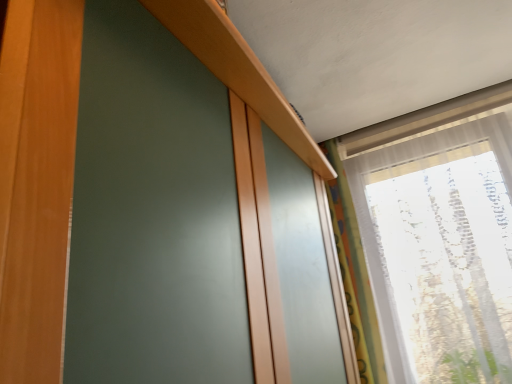
This screenshot has width=512, height=384. What do you see at coordinates (354, 273) in the screenshot?
I see `multicolored fabric curtain at right` at bounding box center [354, 273].

Identify the location of multicolored fabric curtain at right. The image size is (512, 384). coord(354,273).

The height and width of the screenshot is (384, 512). What do you see at coordinates (439, 237) in the screenshot? I see `transparent fabric at upper right` at bounding box center [439, 237].

You are a GUI agent. You are given a task and a screenshot of the screen. Output one action in this format:
    pyautogui.click(x=<x>, y=<y>)
    Task: Click on the transparent fabric at upper right
    
    Given the screenshot: What is the action you would take?
    pyautogui.click(x=439, y=237)

The height and width of the screenshot is (384, 512). In order to click on multicolored fabric curtain at right in this screenshot , I will do (354, 273).

Based on their positions, is transparent fabric at upper right located to the left or right of multicolored fabric curtain at right?

Clearly, transparent fabric at upper right is on the right of multicolored fabric curtain at right in the image.

Is the depth of transparent fabric at upper right greater than that of multicolored fabric curtain at right?

No, it is not.

Which is more distant, (446,197) or (357,281)?

The point (357,281) is farther from the camera.

From the image's perspective, between transparent fabric at upper right and multicolored fabric curtain at right, who is located below?

multicolored fabric curtain at right, from the image's perspective.

From a real-world perspective, is transparent fabric at upper right physically located above or below multicolored fabric curtain at right?

Clearly, from a real-world perspective, transparent fabric at upper right is below multicolored fabric curtain at right.

Is transparent fabric at upper right thinner than multicolored fabric curtain at right?

Incorrect, the width of transparent fabric at upper right is not less than that of multicolored fabric curtain at right.

Which of these two, transparent fabric at upper right or multicolored fabric curtain at right, stands taller?

transparent fabric at upper right.

Does transparent fabric at upper right have a larger size compared to multicolored fabric curtain at right?

Yes, transparent fabric at upper right is bigger than multicolored fabric curtain at right.

Can we say transparent fabric at upper right lies outside multicolored fabric curtain at right?

Yes, transparent fabric at upper right is not within multicolored fabric curtain at right.

Is transparent fabric at upper right directly adjacent to multicolored fabric curtain at right?

transparent fabric at upper right is not next to multicolored fabric curtain at right, and they're not touching.

Is multicolored fabric curtain at right at the back of transparent fabric at upper right?

No.

What's the angular difference between transparent fabric at upper right and multicolored fabric curtain at right's facing directions?

14.1 degrees separate the facing orientations of transparent fabric at upper right and multicolored fabric curtain at right.

From the picture: Measure the distance between transparent fabric at upper right and multicolored fabric curtain at right.

9.24 inches.

This screenshot has height=384, width=512. What are the coordinates of `curtain located above the transparent fabric at upper right (from a real-world perspective)` in the screenshot? It's located at (354, 273).

Which is more to the left, multicolored fabric curtain at right or transparent fabric at upper right?

Positioned to the left is multicolored fabric curtain at right.

Is multicolored fabric curtain at right positioned before transparent fabric at upper right?

No, it is not.

Does point (359, 254) lie in front of point (454, 289)?

No.

From the image's perspective, which is above, multicolored fabric curtain at right or transparent fabric at upper right?

transparent fabric at upper right appears higher in the image.

From a real-world perspective, relative to transparent fabric at upper right, is multicolored fabric curtain at right vertically above or below?

In terms of real-world spatial position, multicolored fabric curtain at right is above transparent fabric at upper right.

Looking at this image, can you confirm if multicolored fabric curtain at right is thinner than transparent fabric at upper right?

Correct, the width of multicolored fabric curtain at right is less than that of transparent fabric at upper right.

Which of these two, multicolored fabric curtain at right or transparent fabric at upper right, stands taller?

transparent fabric at upper right is taller.

Based on their sizes in the image, would you say multicolored fabric curtain at right is bigger or smaller than transparent fabric at upper right?

Considering their sizes, multicolored fabric curtain at right takes up less space than transparent fabric at upper right.

Is multicolored fabric curtain at right outside of transparent fabric at upper right?

Absolutely, multicolored fabric curtain at right is external to transparent fabric at upper right.

Is multicolored fabric curtain at right placed right next to transparent fabric at upper right?

They are not placed beside each other.

Could you tell me if multicolored fabric curtain at right is facing transparent fabric at upper right?

No, multicolored fabric curtain at right does not turn towards transparent fabric at upper right.

How different are the orientations of multicolored fabric curtain at right and transparent fabric at upper right in degrees?

The angle between the facing direction of multicolored fabric curtain at right and the facing direction of transparent fabric at upper right is 14.1 degrees.

The width and height of the screenshot is (512, 384). In order to click on window in front of the multicolored fabric curtain at right in this screenshot , I will do `click(439, 237)`.

This screenshot has width=512, height=384. There is a transparent fabric at upper right. Find the location of `curtain above it (from a real-world perspective)`. curtain above it (from a real-world perspective) is located at coordinates (354, 273).

The height and width of the screenshot is (384, 512). Identify the location of window on the right of multicolored fabric curtain at right. (439, 237).